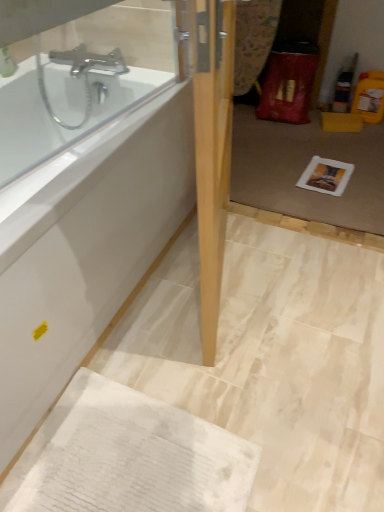
This screenshot has height=512, width=384. I want to click on free space between light wood door at center and transparent glass door at center, so click(282, 281).